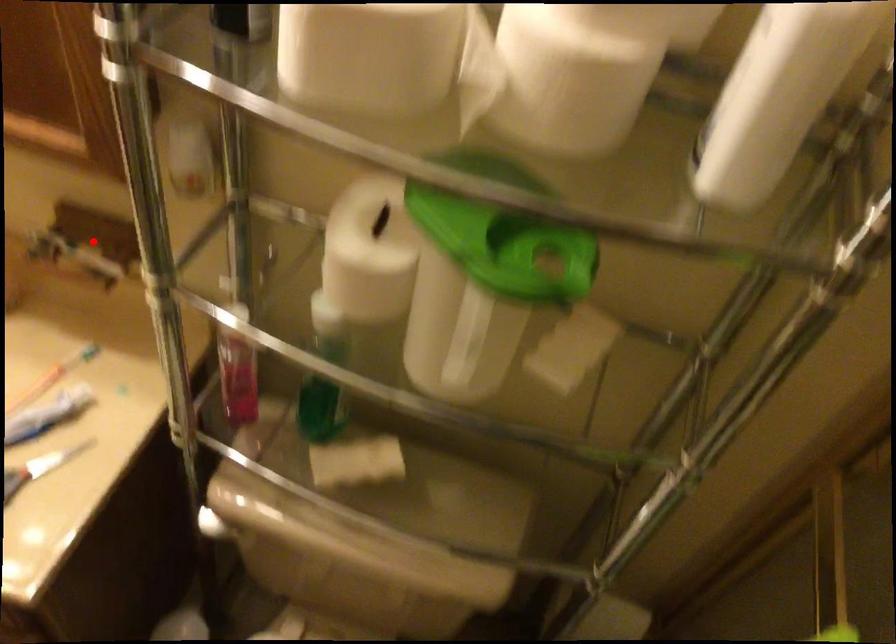
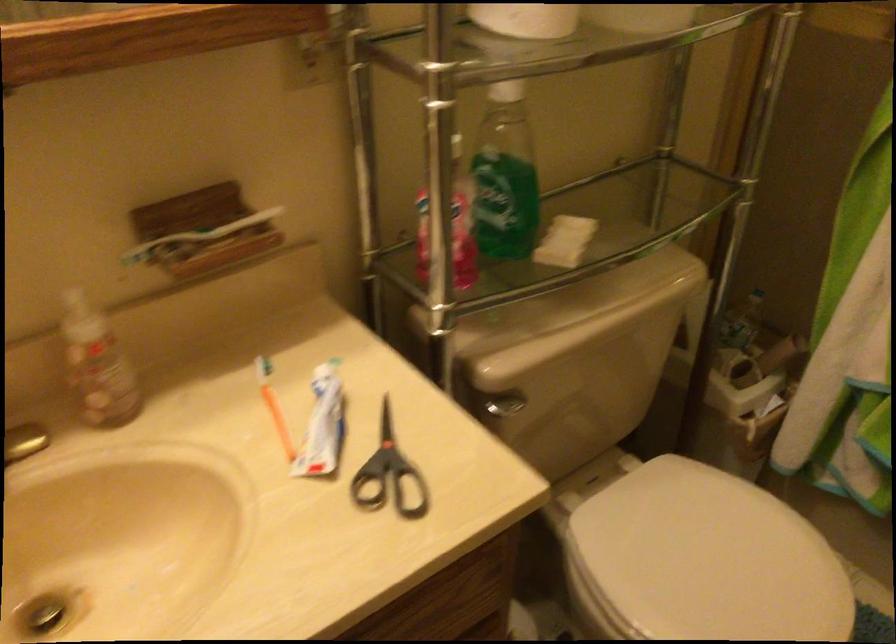
Question: I am providing you with two images of the same scene from different viewpoints. In image1, a red point is highlighted. Considering the same 3D point in image2, which of the following is correct?

Choices:
 (A) It is closer
 (B) It is farther

Answer: (A)